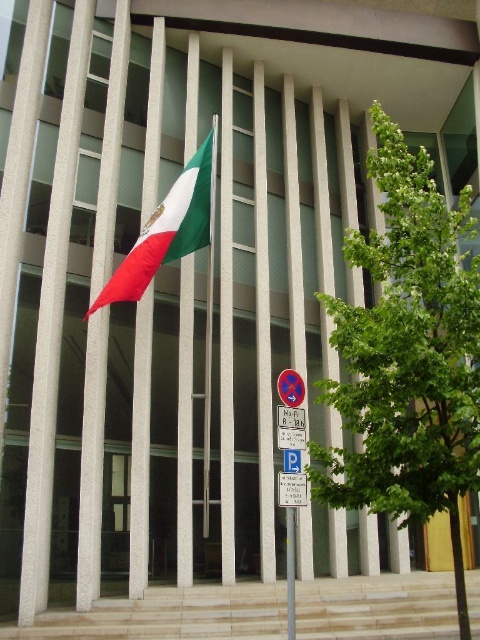
Between green matte flag at center and metallic flag pole at center, which one is positioned lower?

Positioned lower is metallic flag pole at center.

Is green matte flag at center to the right of metallic flag pole at center from the viewer's perspective?

In fact, green matte flag at center is to the left of metallic flag pole at center.

Does point (170, 243) come farther from viewer compared to point (217, 118)?

That is False.

Find the location of `green matte flag at center`. green matte flag at center is located at coordinates (168, 227).

Is point (288, 628) positioned behind point (298, 488)?

No, (288, 628) is closer to viewer.

Who is positioned more to the right, green fabric flag at upper left or white plastic parking sign at center?

From the viewer's perspective, white plastic parking sign at center appears more on the right side.

The height and width of the screenshot is (640, 480). Describe the element at coordinates (289, 572) in the screenshot. I see `green fabric flag at upper left` at that location.

Find the location of a particular element. The image size is (480, 640). green fabric flag at upper left is located at coordinates (289, 572).

Is green leafy tree at right shorter than green matte flag at center?

No, green leafy tree at right is not shorter than green matte flag at center.

Between point (453, 275) and point (137, 248), which one is positioned in front?

Point (453, 275) is in front.

Image resolution: width=480 pixels, height=640 pixels. What are the coordinates of `green leafy tree at right` in the screenshot? It's located at (408, 355).